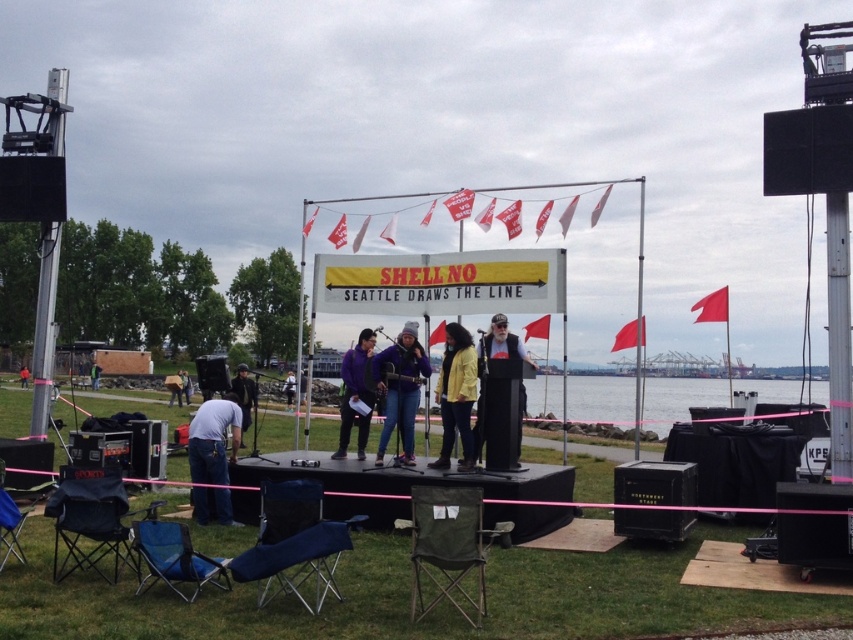
The height and width of the screenshot is (640, 853). What do you see at coordinates (357, 392) in the screenshot?
I see `purple matte jacket at center` at bounding box center [357, 392].

Does purple matte jacket at center come behind dark blue jeans at center?

That is False.

Describe the element at coordinates (357, 392) in the screenshot. This screenshot has width=853, height=640. I see `purple matte jacket at center` at that location.

What are the coordinates of `purple matte jacket at center` in the screenshot? It's located at (357, 392).

Is dark blue jeans at lower left smaller than denim jacket at center?

Correct, dark blue jeans at lower left occupies less space than denim jacket at center.

Can you confirm if dark blue jeans at lower left is positioned to the left of denim jacket at center?

In fact, dark blue jeans at lower left is to the right of denim jacket at center.

Is point (239, 444) in front of point (289, 385)?

Yes, it is in front of point (289, 385).

I want to click on dark blue jeans at lower left, so click(x=244, y=396).

At what (x,y) coordinates should I click in order to perform the action: click on light blue shirt at lower left. Please return your answer as a coordinate pair (x, y). The image size is (853, 640). Looking at the image, I should click on (213, 440).

Where is `light blue shirt at lower left`? Image resolution: width=853 pixels, height=640 pixels. light blue shirt at lower left is located at coordinates (213, 440).

Identify the location of light blue shirt at lower left. (213, 440).